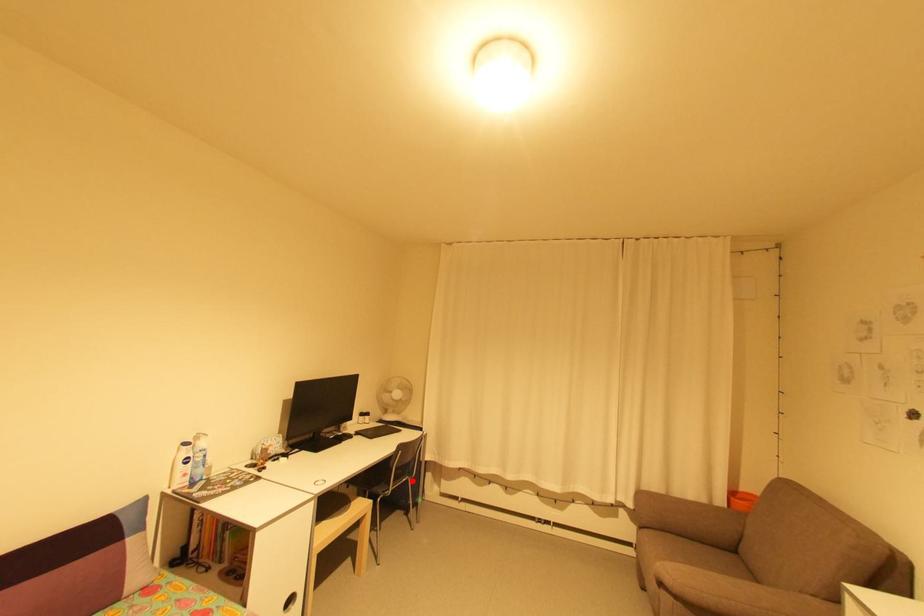
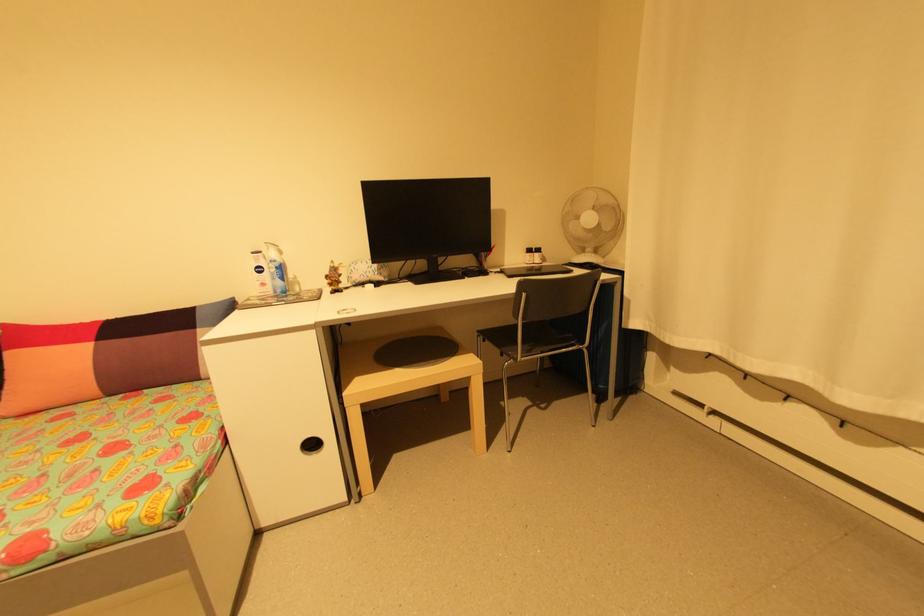
Question: I am providing you with two images of the same scene from different viewpoints. Given a red point in image1, look at the same physical point in image2. Is it:

Choices:
 (A) Closer to the viewpoint
 (B) Farther from the viewpoint

Answer: (A)